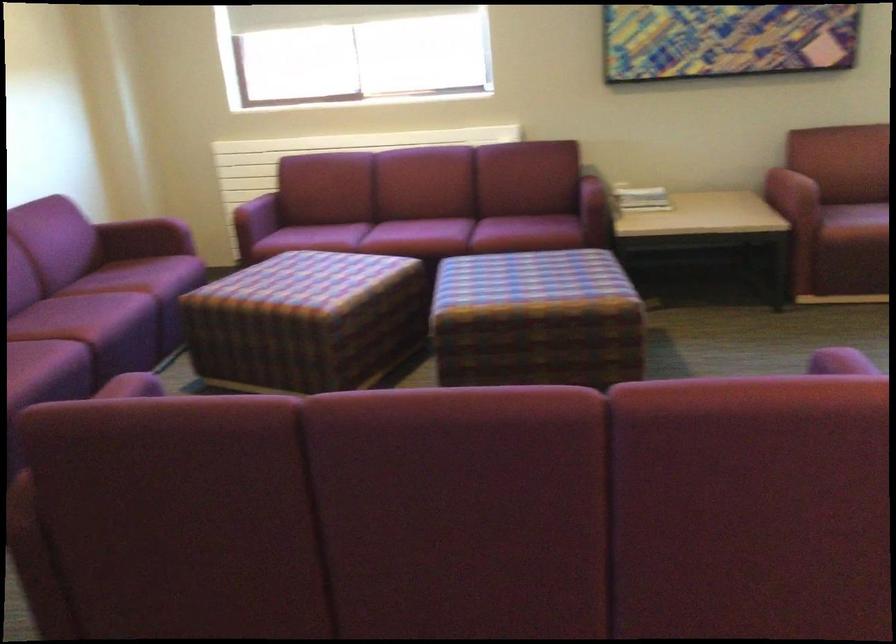
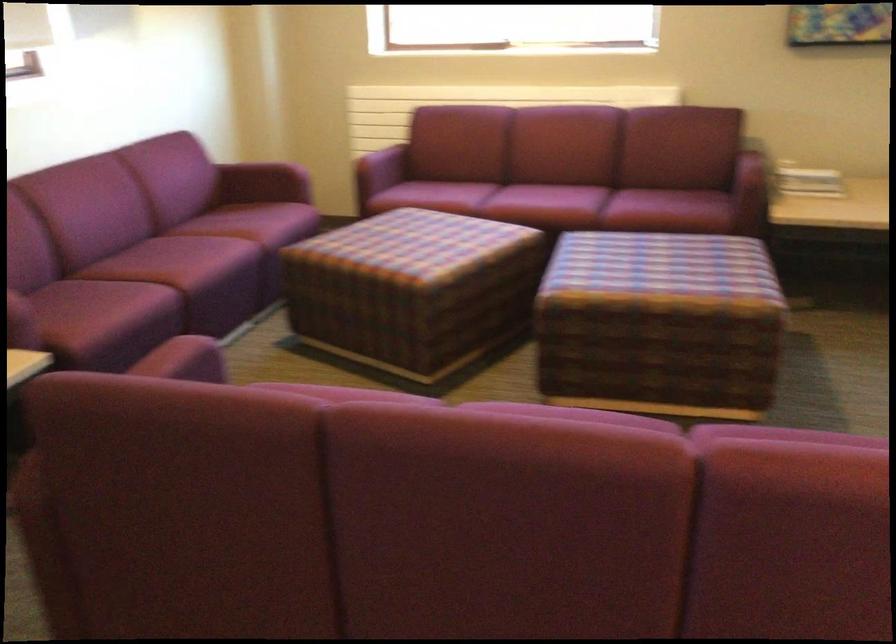
In the second image, find the point that corresponds to pixel 642 196 in the first image.

(807, 180)